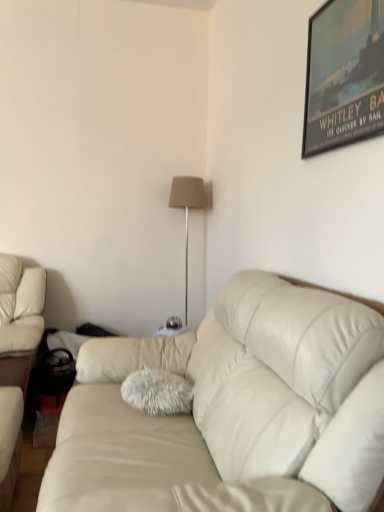
Question: Considering the relative positions of beige fabric lampshade at center and metallic poster at upper right in the image provided, is beige fabric lampshade at center to the left of metallic poster at upper right from the viewer's perspective?

Choices:
 (A) no
 (B) yes

Answer: (B)

Question: Is beige fabric lampshade at center outside of metallic poster at upper right?

Choices:
 (A) yes
 (B) no

Answer: (A)

Question: Considering the relative sizes of beige fabric lampshade at center and metallic poster at upper right in the image provided, is beige fabric lampshade at center taller than metallic poster at upper right?

Choices:
 (A) yes
 (B) no

Answer: (A)

Question: Would you say beige fabric lampshade at center is a long distance from metallic poster at upper right?

Choices:
 (A) no
 (B) yes

Answer: (B)

Question: From the image's perspective, is beige fabric lampshade at center located above metallic poster at upper right?

Choices:
 (A) yes
 (B) no

Answer: (B)

Question: From the image's perspective, is leather couch at center located above or below metallic poster at upper right?

Choices:
 (A) above
 (B) below

Answer: (B)

Question: Relative to metallic poster at upper right, is leather couch at center in front or behind?

Choices:
 (A) behind
 (B) front

Answer: (B)

Question: Is point (354, 337) closer or farther from the camera than point (342, 56)?

Choices:
 (A) farther
 (B) closer

Answer: (B)

Question: Based on their sizes in the image, would you say leather couch at center is bigger or smaller than metallic poster at upper right?

Choices:
 (A) small
 (B) big

Answer: (B)

Question: Considering their positions, is beige fabric lampshade at center located in front of or behind metallic poster at upper right?

Choices:
 (A) behind
 (B) front

Answer: (A)

Question: Considering the relative positions of beige fabric lampshade at center and metallic poster at upper right in the image provided, is beige fabric lampshade at center to the left or to the right of metallic poster at upper right?

Choices:
 (A) right
 (B) left

Answer: (B)

Question: Looking at the image, does beige fabric lampshade at center seem bigger or smaller compared to metallic poster at upper right?

Choices:
 (A) small
 (B) big

Answer: (B)

Question: From a real-world perspective, is beige fabric lampshade at center positioned above or below metallic poster at upper right?

Choices:
 (A) above
 (B) below

Answer: (B)

Question: In the image, is leather couch at center on the left side or the right side of beige fabric lampshade at center?

Choices:
 (A) left
 (B) right

Answer: (B)

Question: Do you think leather couch at center is within beige fabric lampshade at center, or outside of it?

Choices:
 (A) outside
 (B) inside

Answer: (A)